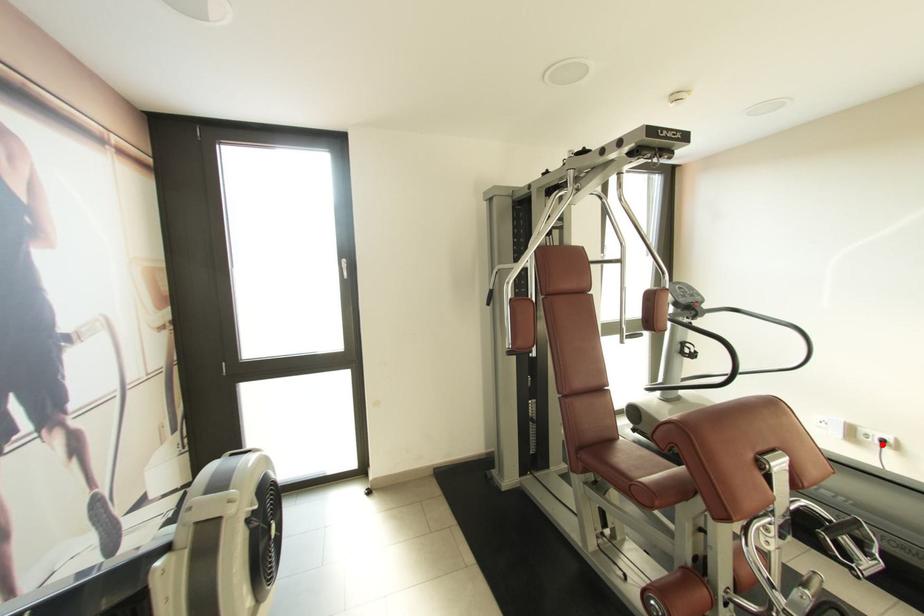
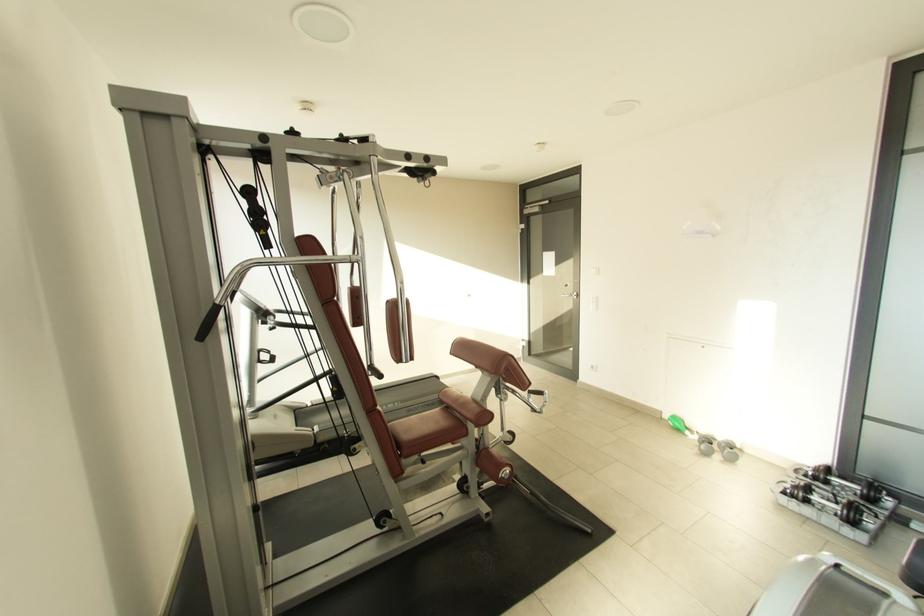
Question: I am providing you with two images of the same scene from different viewpoints. A red point is marked on the first image. Can you still see the location of the red point in image 2?

Choices:
 (A) Yes
 (B) No

Answer: (B)